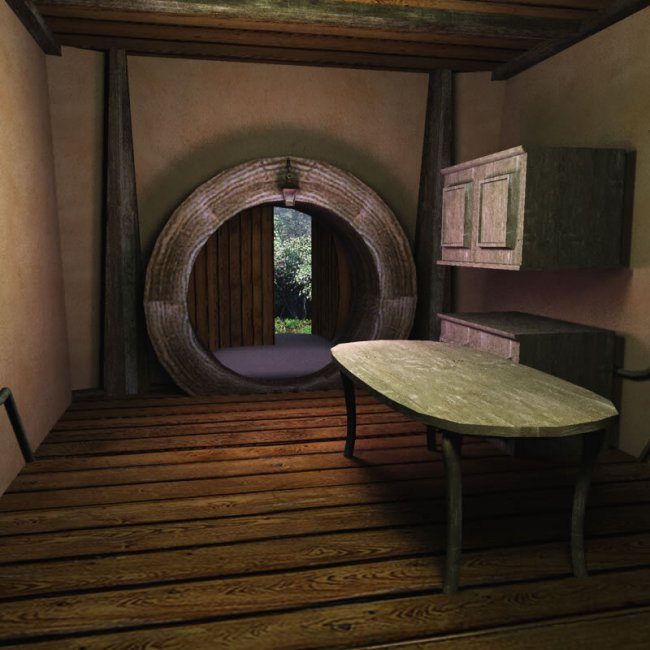
Where is `table`? This screenshot has height=650, width=650. table is located at coordinates (465, 379).